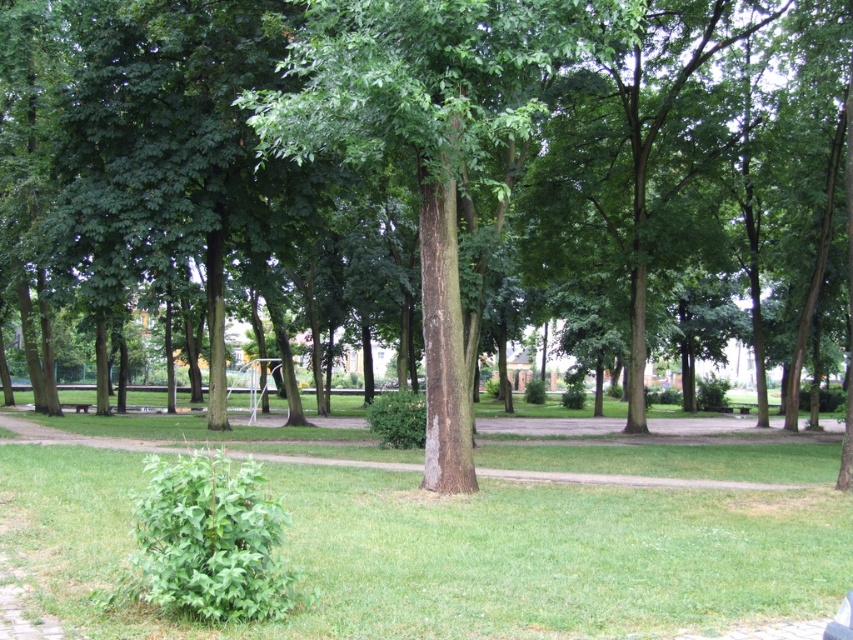
You are standing at the entrance of the park and want to reach the green grass at center. Which direction should you walk to get there?

The green grass at center is located at point coordinates, so you should walk towards the center of the park to reach it.